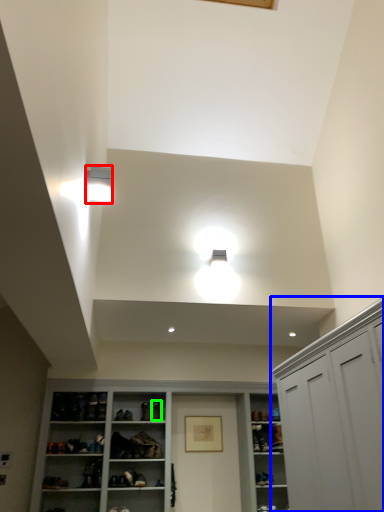
Question: Which object is positioned closest to light fixture (highlighted by a red box)? Select from cabinetry (highlighted by a blue box) and shoe (highlighted by a green box).

Choices:
 (A) cabinetry
 (B) shoe

Answer: (A)